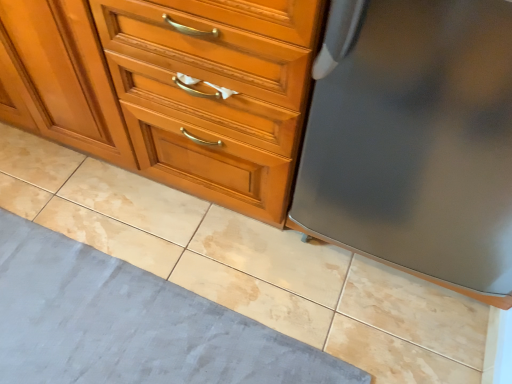
Question: Based on their sizes in the image, would you say satin gray refrigerator at right is bigger or smaller than matte wood chest of drawers at center?

Choices:
 (A) big
 (B) small

Answer: (B)

Question: Visually, is satin gray refrigerator at right positioned to the left or to the right of matte wood chest of drawers at center?

Choices:
 (A) right
 (B) left

Answer: (A)

Question: Estimate the real-world distances between objects in this image. Which object is closer to the gray fabric bath mat at lower left?

Choices:
 (A) satin gray refrigerator at right
 (B) matte wood chest of drawers at center

Answer: (B)

Question: Based on their relative distances, which object is farther from the satin gray refrigerator at right?

Choices:
 (A) matte wood chest of drawers at center
 (B) gray fabric bath mat at lower left

Answer: (B)